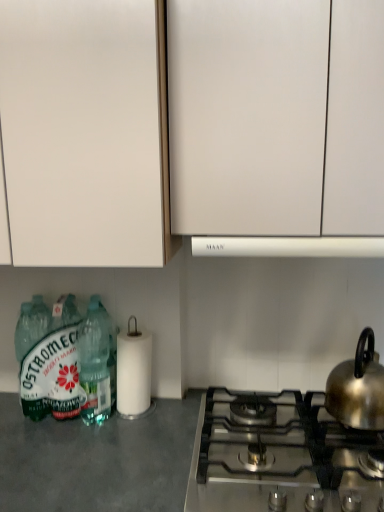
You are a GUI agent. You are given a task and a screenshot of the screen. Output one action in this format:
    pyautogui.click(x=<x>, y=<y>)
    Task: Click on the vacant area located to the right-hand side of white matte paper towel at lower center
    
    Given the screenshot: What is the action you would take?
    pyautogui.click(x=178, y=407)